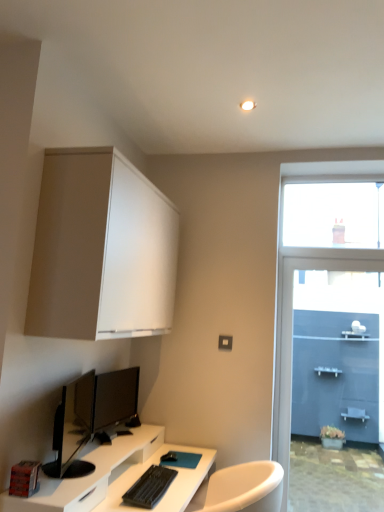
Identify the location of vacant space underneath black glossy monitor at center, the 1th computer monitor when ordered from back to front (from a real-world perspective). (121, 439).